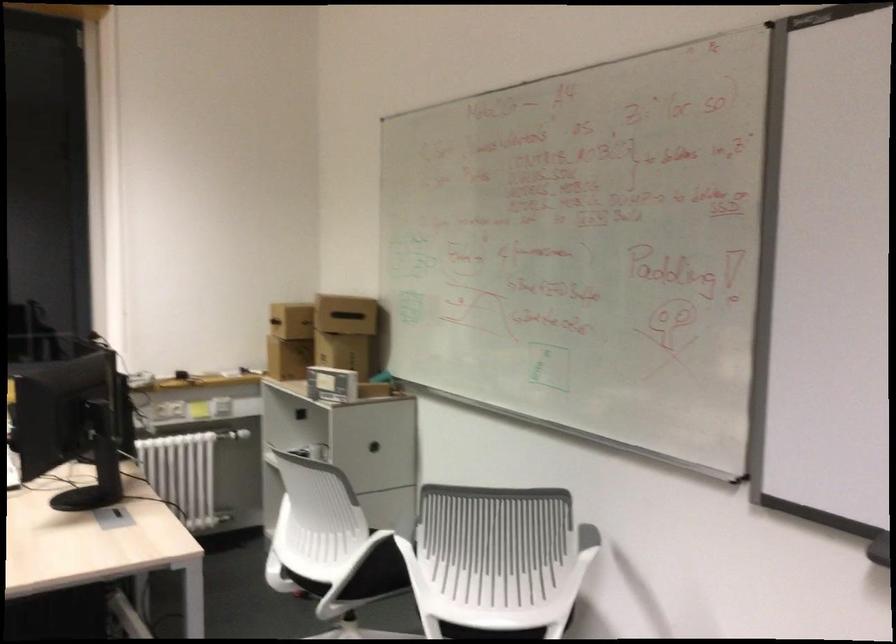
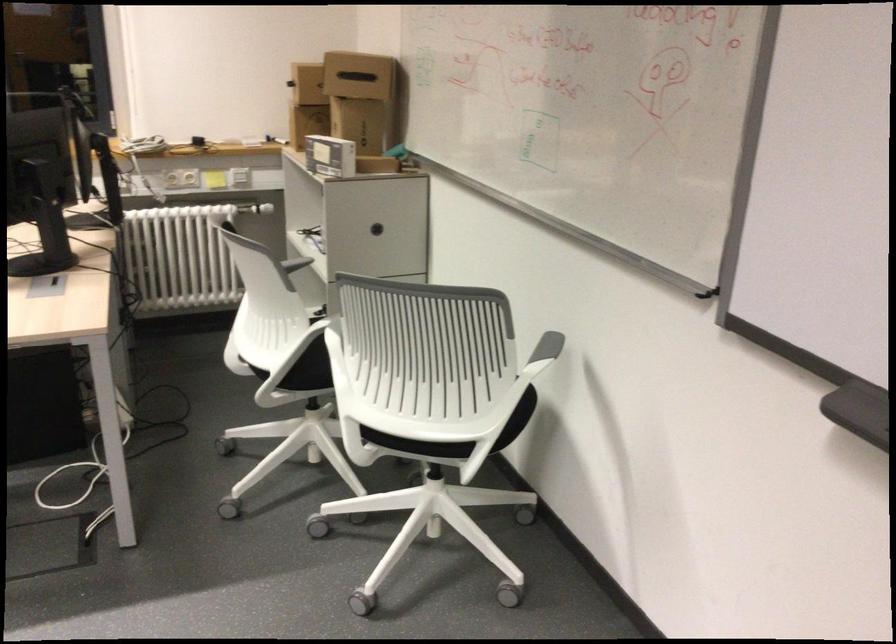
In the second image, find the point that corresponds to the point at 289,321 in the first image.

(307, 84)